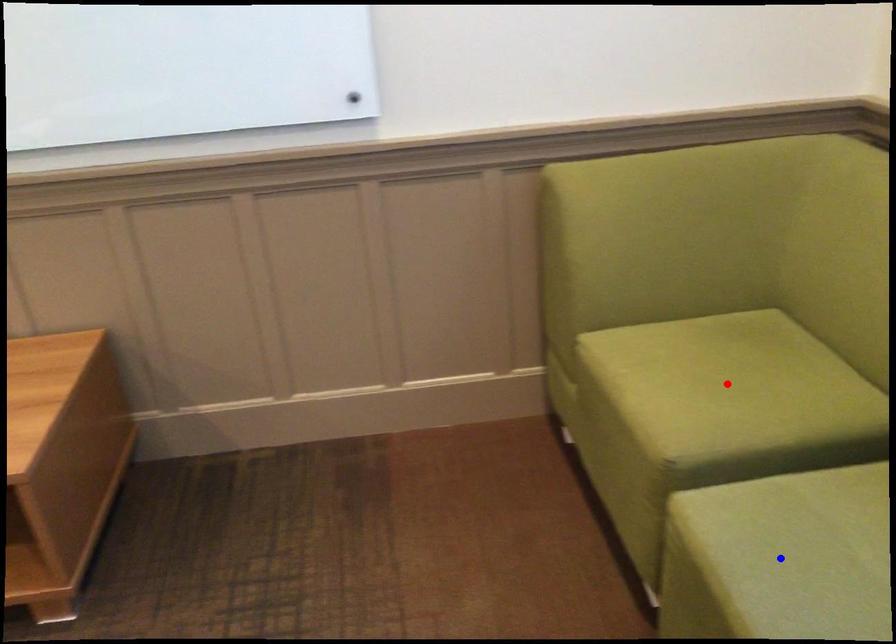
Question: Which of the two points in the image is closer to the camera?

Choices:
 (A) Blue point is closer.
 (B) Red point is closer.

Answer: (A)